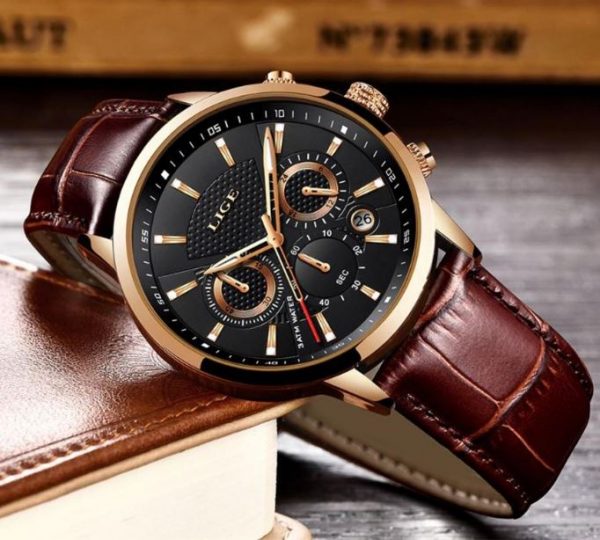
What are the coordinates of `brown leather book cover` in the screenshot? It's located at (84, 382).